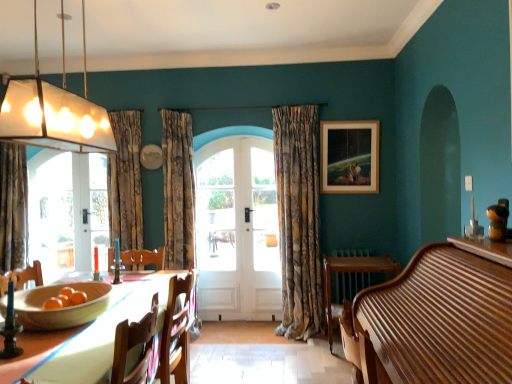
Question: From a real-world perspective, is textured beige curtain at center, which is counted as the third curtain, starting from the left, below translucent glass pendant light at upper left?

Choices:
 (A) yes
 (B) no

Answer: (A)

Question: Are textured beige curtain at center, which is counted as the first curtain, starting from the right, and translucent glass pendant light at upper left located far from each other?

Choices:
 (A) yes
 (B) no

Answer: (A)

Question: Does textured beige curtain at center, which is counted as the first curtain, starting from the right, appear on the right side of translucent glass pendant light at upper left?

Choices:
 (A) no
 (B) yes

Answer: (B)

Question: From a real-world perspective, does textured beige curtain at center, which is counted as the third curtain, starting from the left, stand above translucent glass pendant light at upper left?

Choices:
 (A) no
 (B) yes

Answer: (A)

Question: Is textured beige curtain at center, which is counted as the first curtain, starting from the right, to the left of translucent glass pendant light at upper left from the viewer's perspective?

Choices:
 (A) yes
 (B) no

Answer: (B)

Question: Is translucent glass pendant light at upper left inside or outside of textured beige curtain at center, which is counted as the first curtain, starting from the right?

Choices:
 (A) outside
 (B) inside

Answer: (A)

Question: Is translucent glass pendant light at upper left taller or shorter than textured beige curtain at center, which is counted as the first curtain, starting from the right?

Choices:
 (A) tall
 (B) short

Answer: (B)

Question: Considering the positions of point (95, 147) and point (303, 196), is point (95, 147) closer or farther from the camera than point (303, 196)?

Choices:
 (A) closer
 (B) farther

Answer: (A)

Question: Is translucent glass pendant light at upper left bigger or smaller than textured beige curtain at center, which is counted as the third curtain, starting from the left?

Choices:
 (A) small
 (B) big

Answer: (A)

Question: Considering the positions of point (31, 201) and point (378, 352), is point (31, 201) closer or farther from the camera than point (378, 352)?

Choices:
 (A) farther
 (B) closer

Answer: (A)

Question: Looking at their shapes, would you say clear glass door at left is wider or thinner than wooden piano at right?

Choices:
 (A) thin
 (B) wide

Answer: (A)

Question: Is clear glass door at left to the left or to the right of wooden piano at right in the image?

Choices:
 (A) left
 (B) right

Answer: (A)

Question: From a real-world perspective, is clear glass door at left physically located above or below wooden piano at right?

Choices:
 (A) below
 (B) above

Answer: (B)

Question: Is translucent glass pendant light at upper left spatially inside wooden round table at lower right, or outside of it?

Choices:
 (A) inside
 (B) outside

Answer: (B)

Question: Considering the relative positions of translucent glass pendant light at upper left and wooden round table at lower right in the image provided, is translucent glass pendant light at upper left to the left or to the right of wooden round table at lower right?

Choices:
 (A) left
 (B) right

Answer: (A)